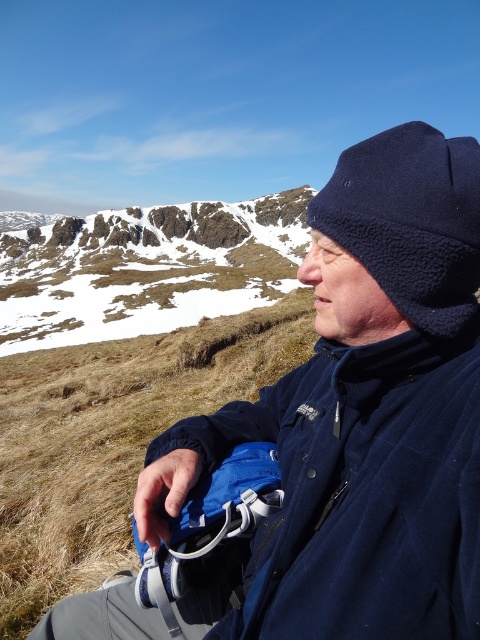
Question: Can you confirm if snowy rocky mountain at upper left is smaller than fleece hat at upper right?

Choices:
 (A) no
 (B) yes

Answer: (A)

Question: Which of these objects is positioned closest to the snowy rocky mountain at upper left?

Choices:
 (A) fleece hat at upper right
 (B) navy blue fleece jacket at center

Answer: (B)

Question: In this image, where is navy blue fleece jacket at center located relative to fleece hat at upper right?

Choices:
 (A) above
 (B) below

Answer: (B)

Question: Is snowy rocky mountain at upper left positioned behind fleece hat at upper right?

Choices:
 (A) no
 (B) yes

Answer: (B)

Question: Among these objects, which one is nearest to the camera?

Choices:
 (A) fleece hat at upper right
 (B) navy blue fleece jacket at center

Answer: (B)

Question: Which object is the farthest from the navy blue fleece jacket at center?

Choices:
 (A) snowy rocky mountain at upper left
 (B) fleece hat at upper right

Answer: (A)